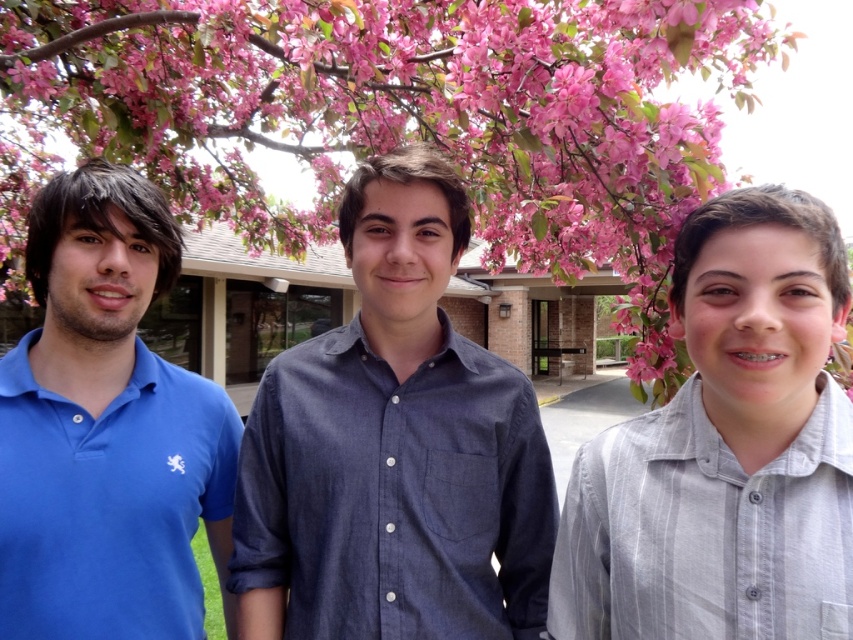
You are a photographer trying to capture a group shot of the gray striped shirt at center and the matte blue polo shirt at left. If you want both subjects to appear equally sized in the photo, what adjustment should you make?

Since the gray striped shirt at center occupies less space than the matte blue polo shirt at left, you should move closer to the gray striped shirt at center to make it larger in the frame while moving away from the matte blue polo shirt at left to reduce its size, ensuring both appear equally sized.

You are standing at the point marked by the coordinates point (724, 449). Which person are you closest to?

The point (724, 449) is on gray striped shirt at center, so you are closest to the person wearing the gray striped shirt at center.

You are a photographer standing behind the gray striped shirt at center and the matte blue polo shirt at left. Which person is closer to you?

The gray striped shirt at center is closer to you because it is in front of the matte blue polo shirt at left.